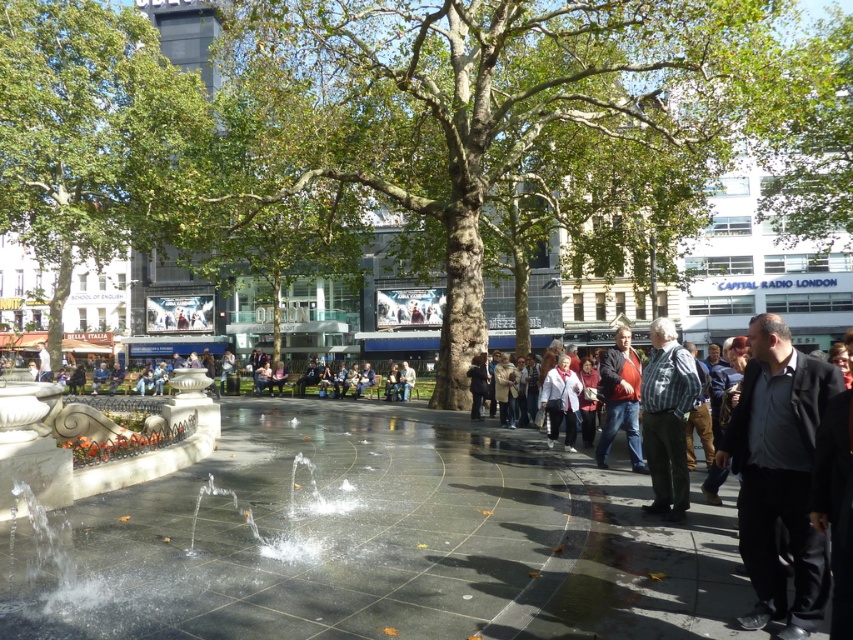
You are a photographer standing in the urban square and want to capture both the black matte jacket at right and the dark brown leather jacket at center in a single photo. Which jacket should you focus on first to ensure both are in frame?

The black matte jacket at right is above the dark brown leather jacket at center, so focusing on the dark brown leather jacket at center first will ensure both are within the frame.

What are the coordinates of the green leafy tree at upper left in the image?

The green leafy tree at upper left is located at coordinates point (88, 134).

You are a tailor who needs to determine which jacket has a larger width to fit a client. You see a black matte jacket at right and a dark brown leather jacket at center. Which one is wider?

The dark brown leather jacket at center is wider than the black matte jacket at right.